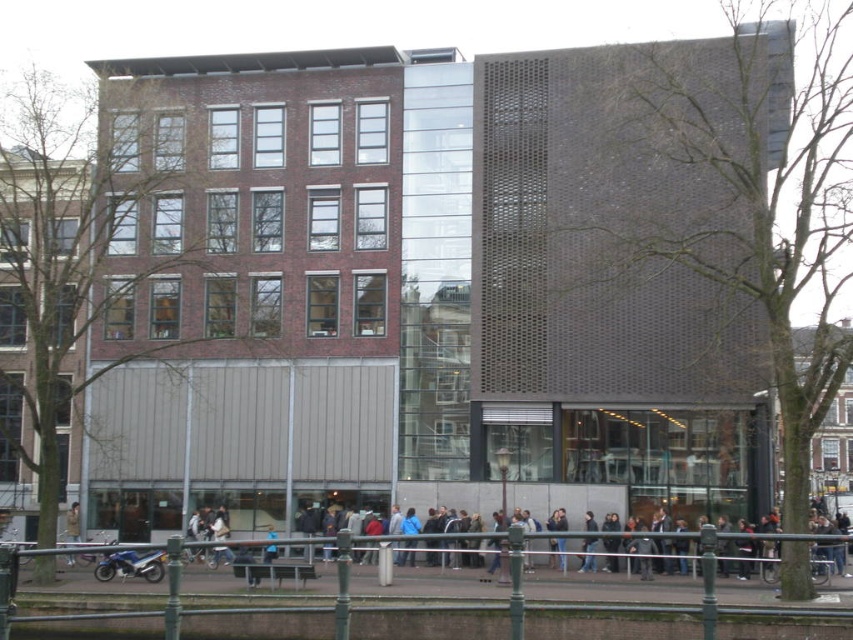
You are a delivery person who needs to park your motorcycle between the blue metallic motorcycle at lower left and the khaki fabric jacket at center. Considering the space between them, will your motorcycle fit?

The blue metallic motorcycle at lower left is thinner than the khaki fabric jacket at center, so the space between them may be sufficient for your motorcycle to fit, but it depends on the exact width of your motorcycle.

You are a delivery person who needs to park your blue metallic motorcycle at lower left near the khaki fabric jacket at center without blocking the sidewalk. Given the space constraints, can you park the motorcycle there?

The blue metallic motorcycle at lower left occupies less space than the khaki fabric jacket at center, so it can be parked near the khaki fabric jacket at center without blocking the sidewalk.